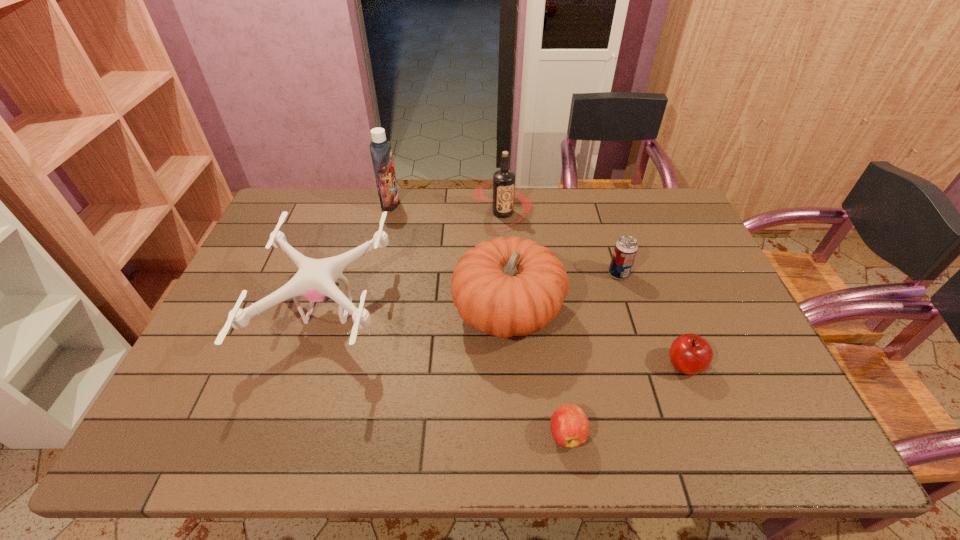
Where is `vacant space located 0.240m on the front label of the shampoo`? The height and width of the screenshot is (540, 960). vacant space located 0.240m on the front label of the shampoo is located at coordinates (468, 203).

The image size is (960, 540). In order to click on vacant region located 0.200m on the label of the root beer in this screenshot , I will do `click(507, 275)`.

Where is `vacant space located on the back of the pumpkin`? The width and height of the screenshot is (960, 540). vacant space located on the back of the pumpkin is located at coordinates coord(504,252).

Locate an element on the screen. Image resolution: width=960 pixels, height=540 pixels. free spot located on the top of the drone is located at coordinates (498, 310).

This screenshot has width=960, height=540. I want to click on vacant space located on the left of the third shortest object, so click(x=564, y=274).

Where is `free spot located 0.340m on the left of the sixth tallest object`? This screenshot has height=540, width=960. free spot located 0.340m on the left of the sixth tallest object is located at coordinates (525, 365).

The height and width of the screenshot is (540, 960). Find the location of `vacant space located on the left of the left apple`. vacant space located on the left of the left apple is located at coordinates (460, 434).

Find the location of a particular element. The width and height of the screenshot is (960, 540). shampoo situated at the far edge is located at coordinates (381, 153).

At what (x,y) coordinates should I click in order to perform the action: click on root beer at the far edge. Please return your answer as a coordinate pair (x, y). Image resolution: width=960 pixels, height=540 pixels. Looking at the image, I should click on (503, 184).

The height and width of the screenshot is (540, 960). Find the location of `object at the near edge`. object at the near edge is located at coordinates (570, 428).